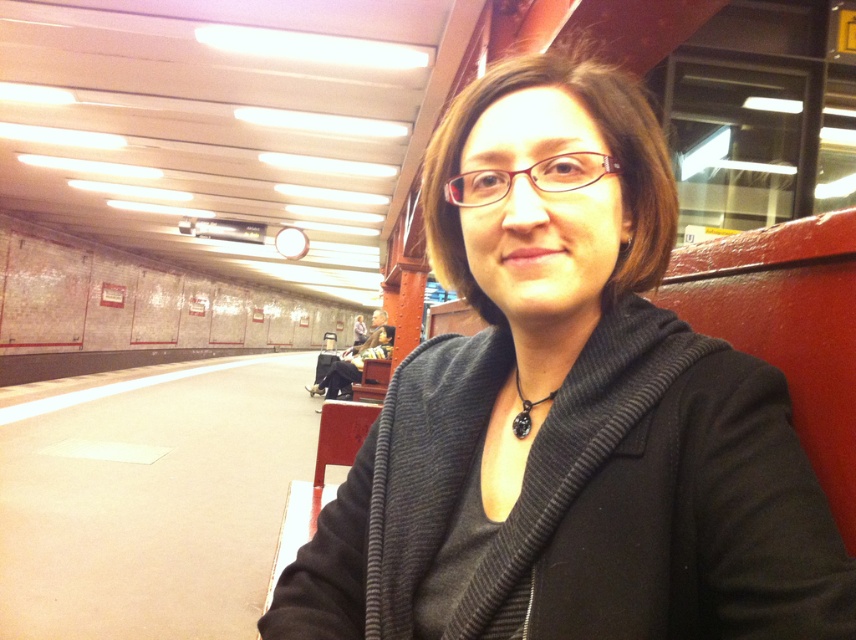
Question: Among these points, which one is nearest to the camera?

Choices:
 (A) pyautogui.click(x=637, y=100)
 (B) pyautogui.click(x=536, y=403)

Answer: (B)

Question: Does black textured sweater at center have a lesser width compared to black leather pendant at center?

Choices:
 (A) yes
 (B) no

Answer: (B)

Question: Considering the relative positions of black textured sweater at center and black leather pendant at center in the image provided, where is black textured sweater at center located with respect to black leather pendant at center?

Choices:
 (A) above
 (B) below

Answer: (A)

Question: Among these objects, which one is nearest to the camera?

Choices:
 (A) black leather pendant at center
 (B) black textured sweater at center

Answer: (B)

Question: Can you confirm if black textured sweater at center is smaller than black leather pendant at center?

Choices:
 (A) no
 (B) yes

Answer: (A)